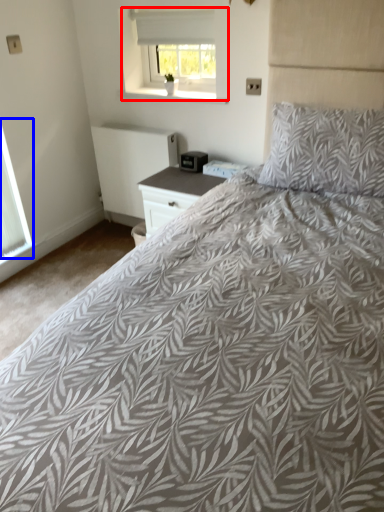
Question: Which object appears farthest to the camera in this image, window (highlighted by a red box) or window (highlighted by a blue box)?

Choices:
 (A) window
 (B) window

Answer: (A)